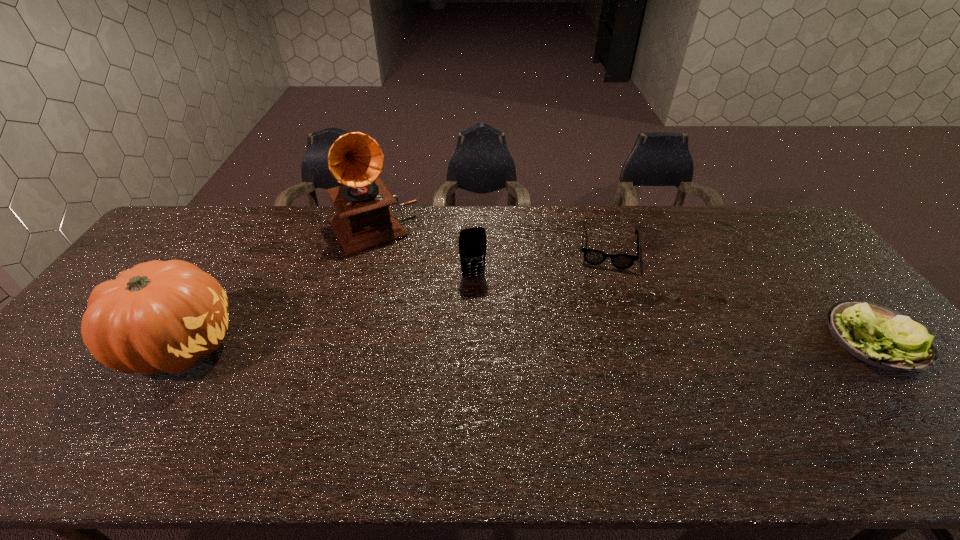
Locate an element on the screen. This screenshot has height=540, width=960. free space located 0.330m on the carved face of the second tallest object is located at coordinates (366, 345).

You are a GUI agent. You are given a task and a screenshot of the screen. Output one action in this format:
    pyautogui.click(x=<x>, y=<y>)
    Task: Click on the vacant space situated 0.090m on the back of the lettuce
    
    Given the screenshot: What is the action you would take?
    pyautogui.click(x=829, y=284)

At what (x,y) coordinates should I click in order to perform the action: click on vacant space positioned on the screen of the third object from left to right. Please return your answer as a coordinate pair (x, y). Looking at the image, I should click on (486, 308).

Identify the location of vacant space located 0.160m on the screen of the third object from left to right. (490, 321).

The width and height of the screenshot is (960, 540). I want to click on free location located on the screen of the third object from left to right, so click(x=482, y=299).

Locate an element on the screen. vacant space situated on the arms of the shortest object is located at coordinates (603, 328).

Where is `vacant space located 0.210m on the arms of the shortest object`? The image size is (960, 540). vacant space located 0.210m on the arms of the shortest object is located at coordinates (603, 320).

Find the location of a particular element. vacant space located on the arms of the shortest object is located at coordinates (601, 357).

The image size is (960, 540). What are the coordinates of `vacant space located 0.380m on the horn of the tallest object` in the screenshot? It's located at (435, 333).

Find the location of a particular element. vacant space located on the horn of the tallest object is located at coordinates (420, 307).